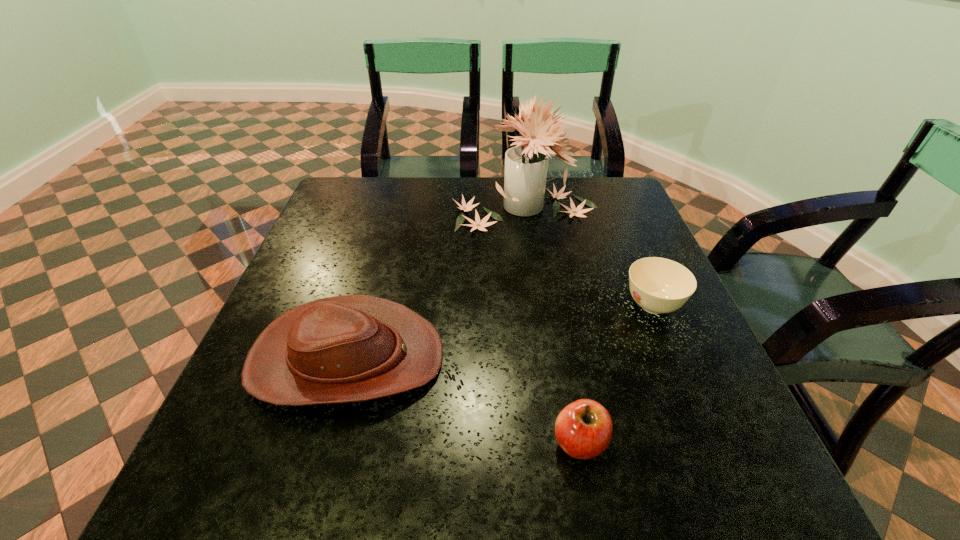
At what (x,y) coordinates should I click in order to perform the action: click on vacant space that is in between the sugar bowl and the cowboy hat. Please return your answer as a coordinate pair (x, y). This screenshot has height=540, width=960. Looking at the image, I should click on (500, 332).

The height and width of the screenshot is (540, 960). Identify the location of blank region between the apple and the bouquet. click(552, 325).

Find the location of a particular element. This screenshot has width=960, height=540. free spot between the bouquet and the sugar bowl is located at coordinates (588, 257).

Locate an element on the screen. The height and width of the screenshot is (540, 960). free space that is in between the apple and the sugar bowl is located at coordinates (616, 374).

The height and width of the screenshot is (540, 960). What are the coordinates of `vacant space in between the apple and the cowboy hat` in the screenshot? It's located at (464, 400).

Locate an element on the screen. The image size is (960, 540). vacant space that is in between the sugar bowl and the cowboy hat is located at coordinates (500, 332).

In order to click on unoccupied position between the cowboy hat and the bouquet in this screenshot , I will do `click(435, 284)`.

At what (x,y) coordinates should I click in order to perform the action: click on free space between the apple and the bouquet. Please return your answer as a coordinate pair (x, y). Looking at the image, I should click on (552, 325).

Locate an element on the screen. vacant area between the farthest object and the cowboy hat is located at coordinates (435, 284).

Locate an element on the screen. The image size is (960, 540). free space between the apple and the bouquet is located at coordinates (552, 325).